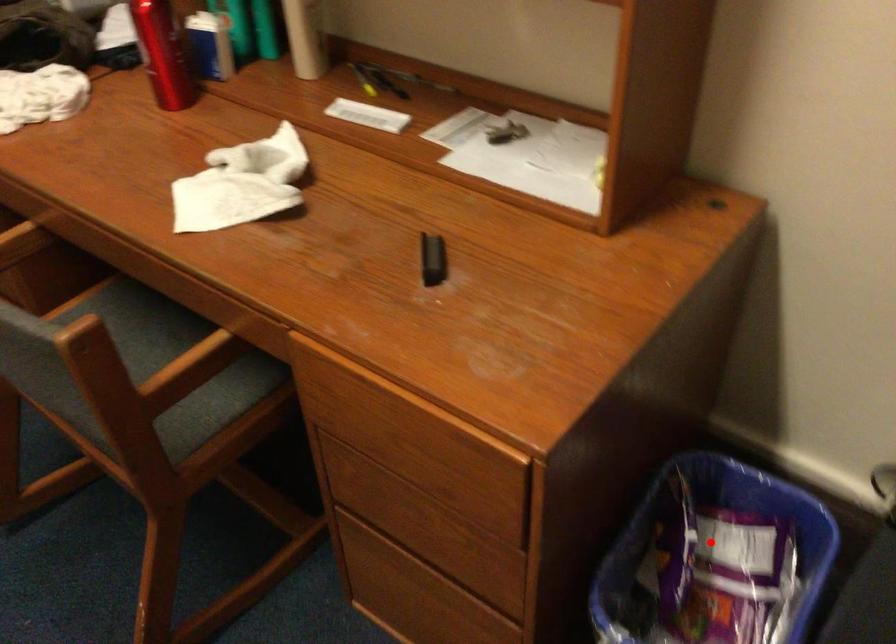
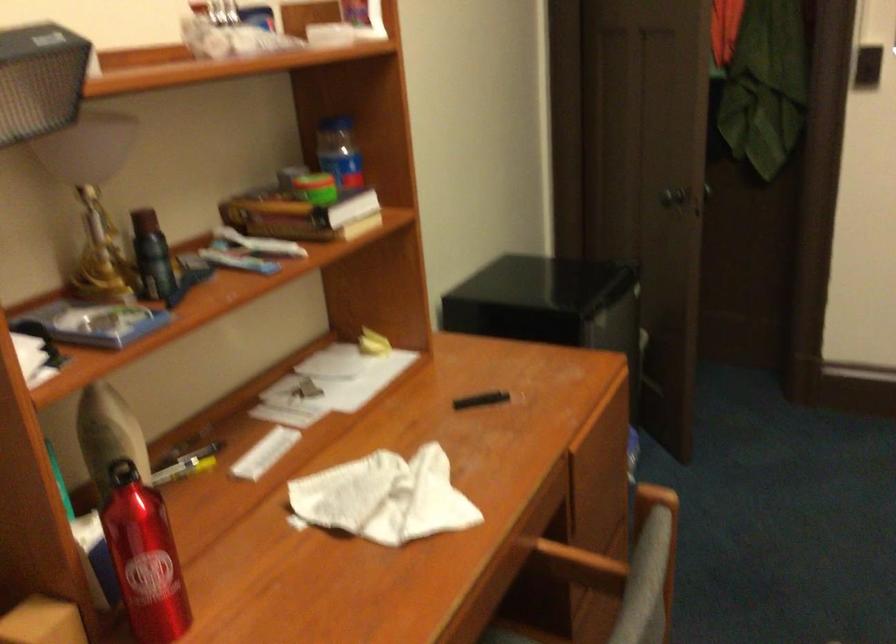
Question: I am providing you with two images of the same scene from different viewpoints. A red point is marked on the first image. Can you still see the location of the red point in image 2?

Choices:
 (A) Yes
 (B) No

Answer: (B)